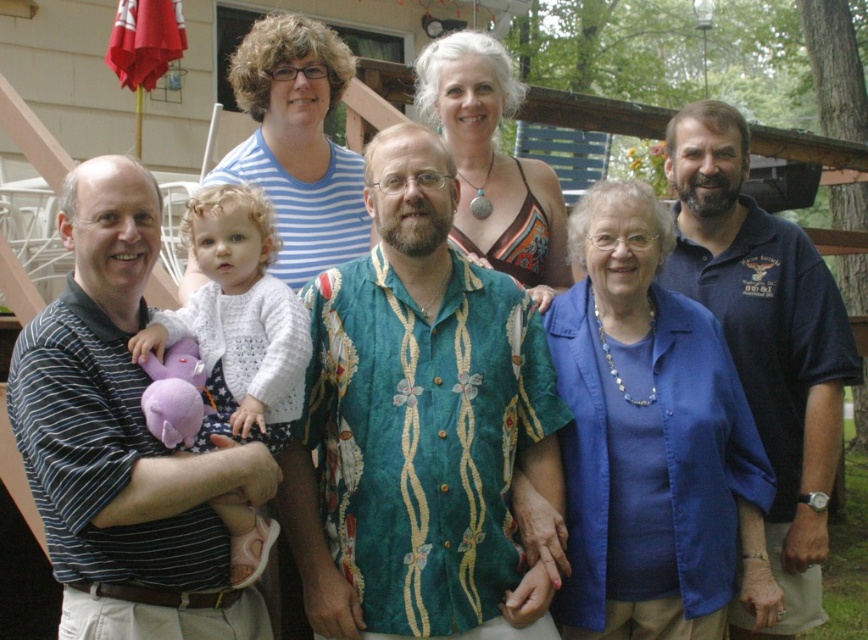
You are a photographer setting up for a group photo. You notice two people in the scene wearing a dark blue polo shirt at right and a white knitted sweater at center. Which person should you adjust the camera focus on first if you want to ensure their clothing details are sharp, considering their sizes?

The dark blue polo shirt at right is larger in width than the white knitted sweater at center, so you should focus on the dark blue polo shirt at right first to capture its details clearly.

You are a photographer trying to capture a clear shot of the green floral shirt at center and the white knitted sweater at center. Which one is lower in the frame?

The green floral shirt at center is positioned under the white knitted sweater at center, so it is lower in the frame.

From the picture: You are a photographer trying to capture a group photo of the individuals in the scene. You notice the green floral shirt at center and the white knitted sweater at center. Which clothing item should you focus on to ensure the subject wearing it is in the foreground of the photo?

The green floral shirt at center should be focused on because it has a greater height compared to the white knitted sweater at center, making it more prominent in the foreground.